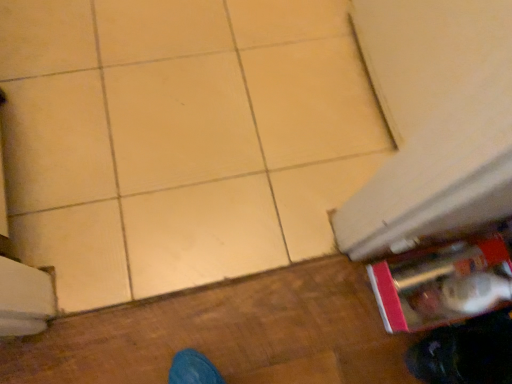
The height and width of the screenshot is (384, 512). I want to click on black matte shoe at lower right, so click(466, 352).

This screenshot has width=512, height=384. What do you see at coordinates (466, 352) in the screenshot?
I see `black matte shoe at lower right` at bounding box center [466, 352].

You are a GUI agent. You are given a task and a screenshot of the screen. Output one action in this format:
    pyautogui.click(x=<x>, y=<y>)
    Task: Click on the black matte shoe at lower right
    
    Given the screenshot: What is the action you would take?
    pyautogui.click(x=466, y=352)